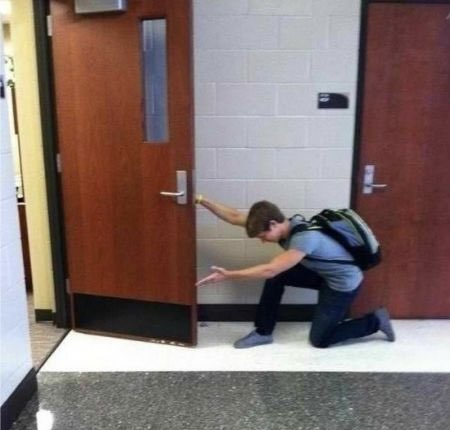
I want to click on door hinge, so click(51, 26), click(68, 291), click(58, 162).